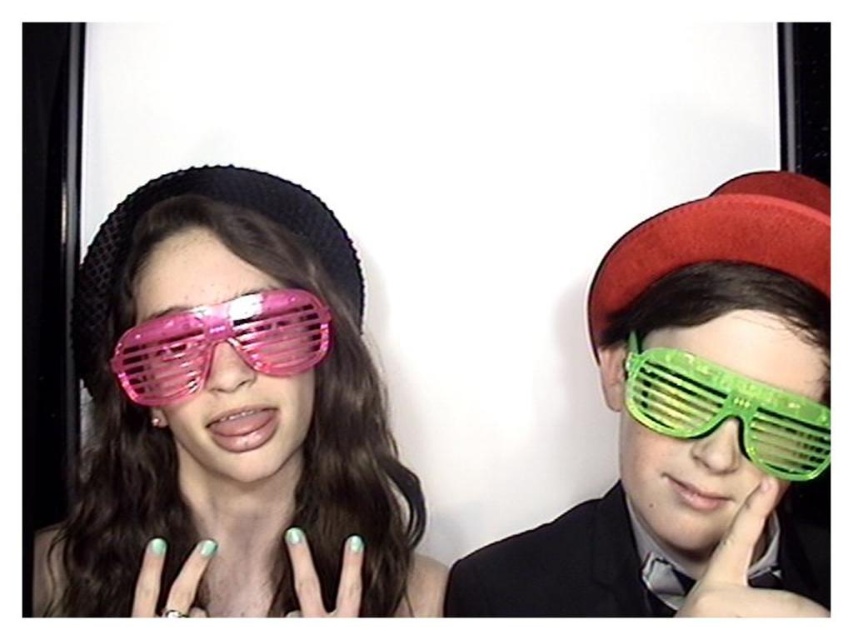
You are a photographer adjusting your camera settings. You notice the green translucent glasses at right and the teal matte nails at center in your frame. Which object is closer to your camera lens?

The green translucent glasses at right is closer to the camera lens because it is further to the viewer than the teal matte nails at center.

You are a photographer trying to focus on the green translucent glasses at right. Given that the camera is set to focus at point (679, 474), will the glasses be in focus?

The point (679, 474) marks the green translucent glasses at right, so yes, the glasses will be in focus as the camera is set to focus at that point.